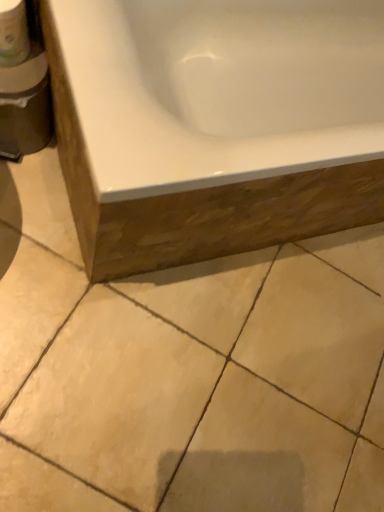
Question: Is beige ceramic tile at lower center at the left side of white matte toilet paper at upper left?

Choices:
 (A) yes
 (B) no

Answer: (B)

Question: Is beige ceramic tile at lower center further to camera compared to white matte toilet paper at upper left?

Choices:
 (A) yes
 (B) no

Answer: (A)

Question: Does beige ceramic tile at lower center have a lesser width compared to white matte toilet paper at upper left?

Choices:
 (A) yes
 (B) no

Answer: (B)

Question: Does beige ceramic tile at lower center touch white matte toilet paper at upper left?

Choices:
 (A) no
 (B) yes

Answer: (A)

Question: From a real-world perspective, is beige ceramic tile at lower center located higher than white matte toilet paper at upper left?

Choices:
 (A) yes
 (B) no

Answer: (B)

Question: Does beige ceramic tile at lower center come in front of white matte toilet paper at upper left?

Choices:
 (A) yes
 (B) no

Answer: (B)

Question: Does white matte toilet paper at upper left appear on the right side of white glossy bathtub at upper center?

Choices:
 (A) no
 (B) yes

Answer: (A)

Question: Is white matte toilet paper at upper left positioned in front of white glossy bathtub at upper center?

Choices:
 (A) no
 (B) yes

Answer: (A)

Question: Is white glossy bathtub at upper center surrounded by white matte toilet paper at upper left?

Choices:
 (A) yes
 (B) no

Answer: (B)

Question: Is white matte toilet paper at upper left further to the viewer compared to white glossy bathtub at upper center?

Choices:
 (A) yes
 (B) no

Answer: (A)

Question: From a real-world perspective, is white matte toilet paper at upper left located higher than white glossy bathtub at upper center?

Choices:
 (A) yes
 (B) no

Answer: (A)

Question: From the image's perspective, would you say white matte toilet paper at upper left is positioned over white glossy bathtub at upper center?

Choices:
 (A) no
 (B) yes

Answer: (B)

Question: From a real-world perspective, is beige ceramic tile at lower center positioned under white glossy bathtub at upper center based on gravity?

Choices:
 (A) yes
 (B) no

Answer: (A)